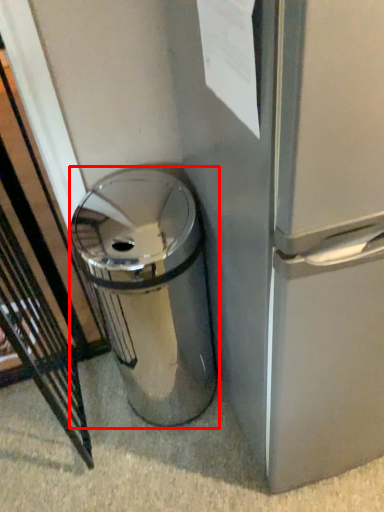
Question: From the image's perspective, considering the relative positions of waste container (annotated by the red box) and paper in the image provided, where is waste container (annotated by the red box) located with respect to the staircase?

Choices:
 (A) above
 (B) below

Answer: (B)